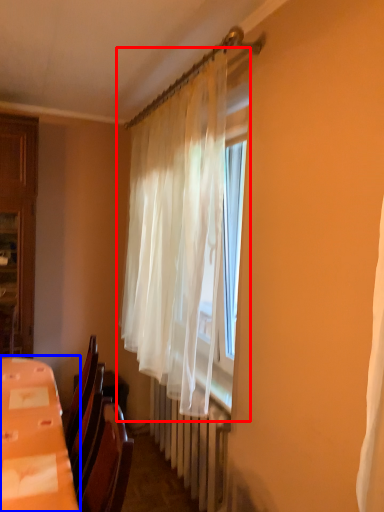
Question: Which object is further to the camera taking this photo, curtain (highlighted by a red box) or table (highlighted by a blue box)?

Choices:
 (A) curtain
 (B) table

Answer: (A)